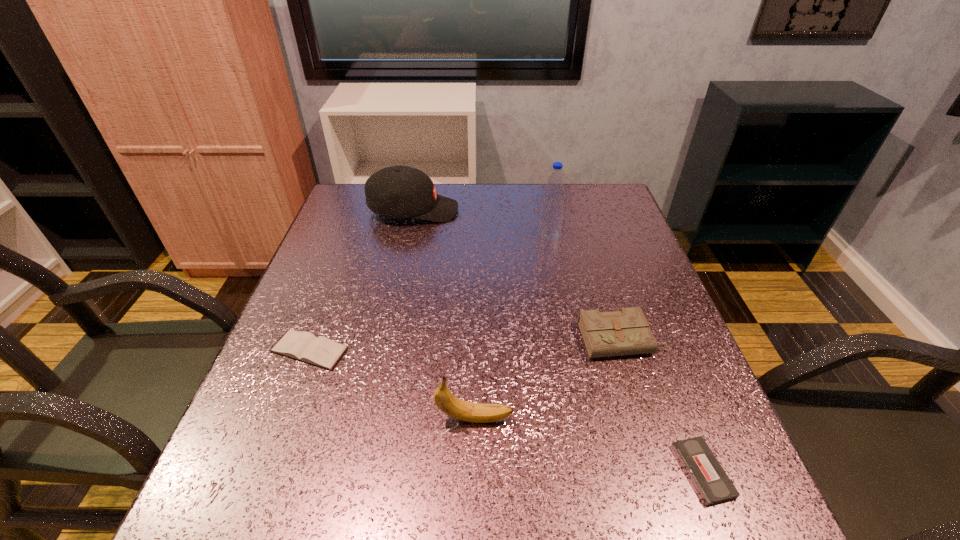
The height and width of the screenshot is (540, 960). What are the coordinates of `free space located 0.120m on the back of the tallest object` in the screenshot? It's located at (543, 205).

Where is `vacant space located 0.150m with a logo on the front of the farthest object`? vacant space located 0.150m with a logo on the front of the farthest object is located at coordinates (510, 211).

Find the location of `vacant space positioned at the start of the peel on the second nearest object`. vacant space positioned at the start of the peel on the second nearest object is located at coordinates click(x=620, y=418).

The image size is (960, 540). I want to click on blank space located on the back of the right diary, so click(598, 264).

Identify the location of vacant area situated on the right of the shorter diary. [x=536, y=350].

Locate an element on the screen. The width and height of the screenshot is (960, 540). vacant region located on the back of the videotape is located at coordinates (679, 408).

Image resolution: width=960 pixels, height=540 pixels. Identify the location of object that is at the far edge. (400, 191).

Find the location of a particular element. object present at the near edge is located at coordinates (713, 485).

Find the location of a particular element. The image size is (960, 540). baseball cap present at the left edge is located at coordinates (400, 191).

I want to click on diary that is at the left edge, so click(x=305, y=347).